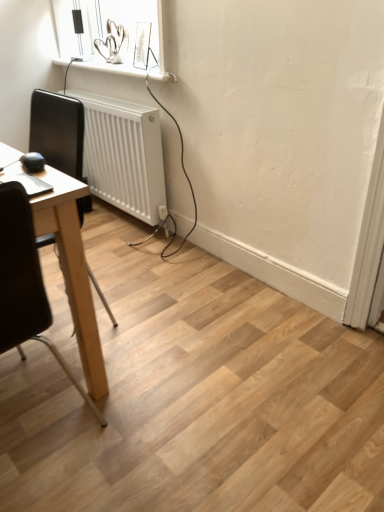
Image resolution: width=384 pixels, height=512 pixels. Find the location of `free location to the right of black leather chair at left, positioned as the second chair in front-to-back order`. free location to the right of black leather chair at left, positioned as the second chair in front-to-back order is located at coordinates (160, 316).